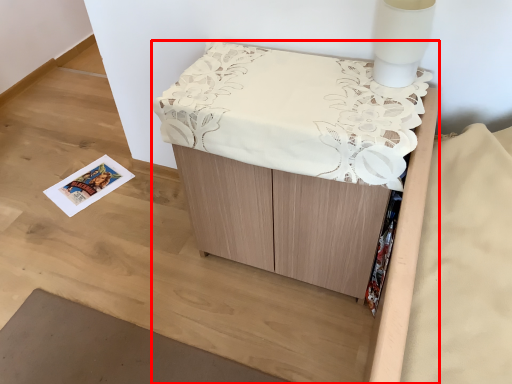
Question: From the image's perspective, what is the correct spatial positioning of furniture (annotated by the red box) in reference to table lamp?

Choices:
 (A) below
 (B) above

Answer: (A)